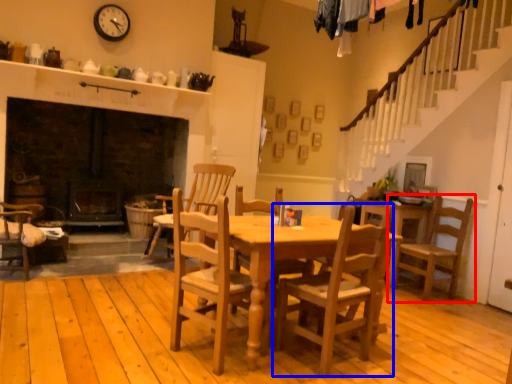
Question: Which object appears farthest to the camera in this image, chair (highlighted by a red box) or chair (highlighted by a blue box)?

Choices:
 (A) chair
 (B) chair

Answer: (A)